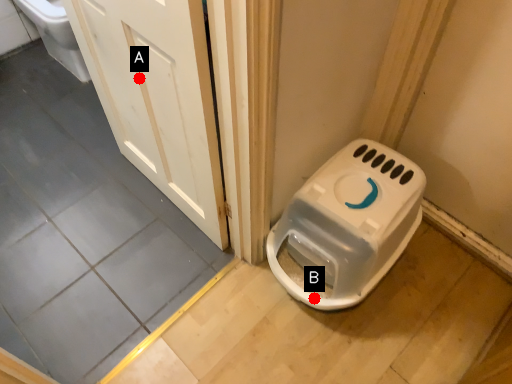
Question: Two points are circled on the image, labeled by A and B beside each circle. Which point appears closest to the camera in this image?

Choices:
 (A) A is closer
 (B) B is closer

Answer: (A)